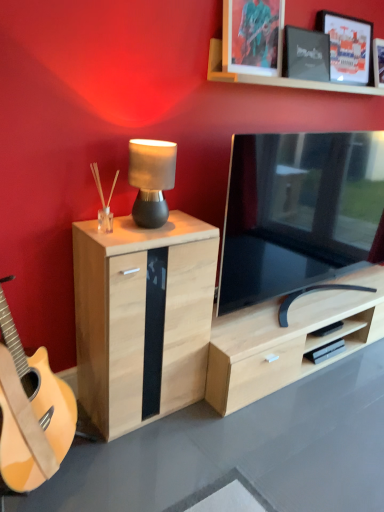
Question: Is black matte picture frame at upper right, which is the second picture frame from left to right, at the back of metallic silver picture frame at upper center, which is counted as the 3th picture frame, starting from the right?

Choices:
 (A) yes
 (B) no

Answer: (B)

Question: Is black matte picture frame at upper right, the 2th picture frame viewed from the right, located within metallic silver picture frame at upper center, which is counted as the 3th picture frame, starting from the right?

Choices:
 (A) no
 (B) yes

Answer: (A)

Question: Considering the relative sizes of metallic silver picture frame at upper center, the 1th picture frame viewed from the left, and black matte picture frame at upper right, the 2th picture frame viewed from the right, in the image provided, is metallic silver picture frame at upper center, the 1th picture frame viewed from the left, bigger than black matte picture frame at upper right, the 2th picture frame viewed from the right,?

Choices:
 (A) yes
 (B) no

Answer: (A)

Question: Is there a large distance between metallic silver picture frame at upper center, which is counted as the 3th picture frame, starting from the right, and black matte picture frame at upper right, the 2th picture frame viewed from the right?

Choices:
 (A) no
 (B) yes

Answer: (A)

Question: From a real-world perspective, is metallic silver picture frame at upper center, the 1th picture frame viewed from the left, on black matte picture frame at upper right, which is the second picture frame from left to right?

Choices:
 (A) no
 (B) yes

Answer: (B)

Question: Is black glossy tv at center inside the boundaries of metallic silver picture frame at upper center, which is counted as the 3th picture frame, starting from the right, or outside?

Choices:
 (A) outside
 (B) inside

Answer: (A)

Question: Looking at the image, does black glossy tv at center seem bigger or smaller compared to metallic silver picture frame at upper center, which is counted as the 3th picture frame, starting from the right?

Choices:
 (A) big
 (B) small

Answer: (A)

Question: In terms of height, does black glossy tv at center look taller or shorter compared to metallic silver picture frame at upper center, which is counted as the 3th picture frame, starting from the right?

Choices:
 (A) short
 (B) tall

Answer: (B)

Question: From the image's perspective, relative to metallic silver picture frame at upper center, which is counted as the 3th picture frame, starting from the right, is black glossy tv at center above or below?

Choices:
 (A) above
 (B) below

Answer: (B)

Question: Visually, is black glossy tv at center positioned to the left or to the right of matte black picture frame at upper right, the 3th picture frame when ordered from left to right?

Choices:
 (A) right
 (B) left

Answer: (B)

Question: Considering the positions of point (258, 178) and point (347, 47), is point (258, 178) closer or farther from the camera than point (347, 47)?

Choices:
 (A) closer
 (B) farther

Answer: (A)

Question: Looking at their shapes, would you say black glossy tv at center is wider or thinner than matte black picture frame at upper right, the first picture frame from the right?

Choices:
 (A) wide
 (B) thin

Answer: (A)

Question: Based on their sizes in the image, would you say black glossy tv at center is bigger or smaller than matte black picture frame at upper right, the first picture frame from the right?

Choices:
 (A) big
 (B) small

Answer: (A)

Question: Is matte black picture frame at upper right, the 3th picture frame when ordered from left to right, situated inside natural wood cabinet at left or outside?

Choices:
 (A) inside
 (B) outside

Answer: (B)

Question: Is matte black picture frame at upper right, the first picture frame from the right, in front of or behind natural wood cabinet at left in the image?

Choices:
 (A) front
 (B) behind

Answer: (B)